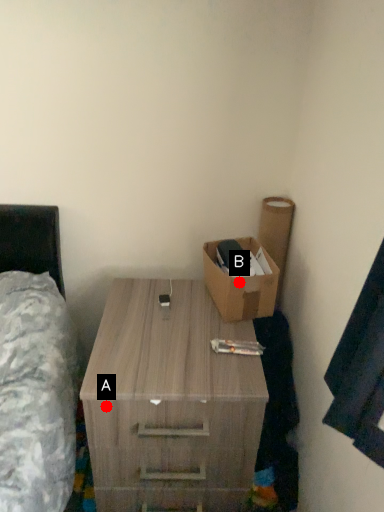
Question: Two points are circled on the image, labeled by A and B beside each circle. Which point is farther from the camera taking this photo?

Choices:
 (A) A is further
 (B) B is further

Answer: (B)